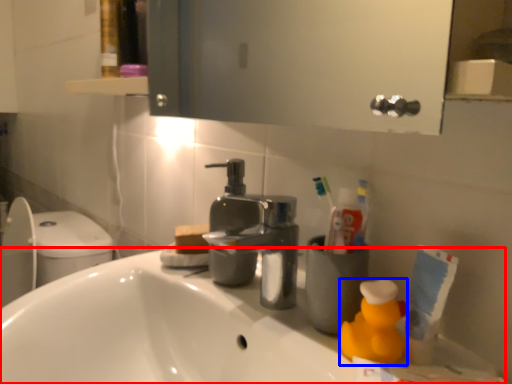
Question: Which object appears closest to the camera in this image, counter top (highlighted by a red box) or cleaning product (highlighted by a blue box)?

Choices:
 (A) counter top
 (B) cleaning product

Answer: (A)